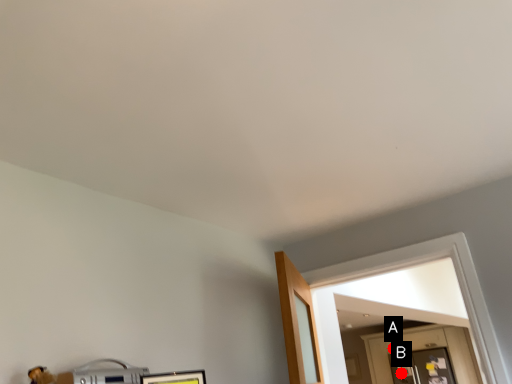
Question: Two points are circled on the image, labeled by A and B beside each circle. Which point is closer to the camera?

Choices:
 (A) A is closer
 (B) B is closer

Answer: (B)